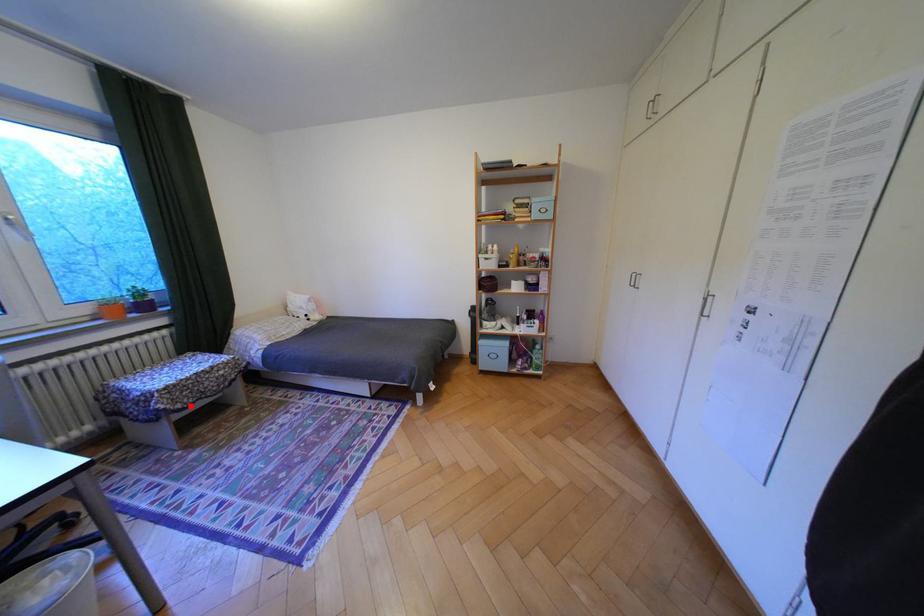
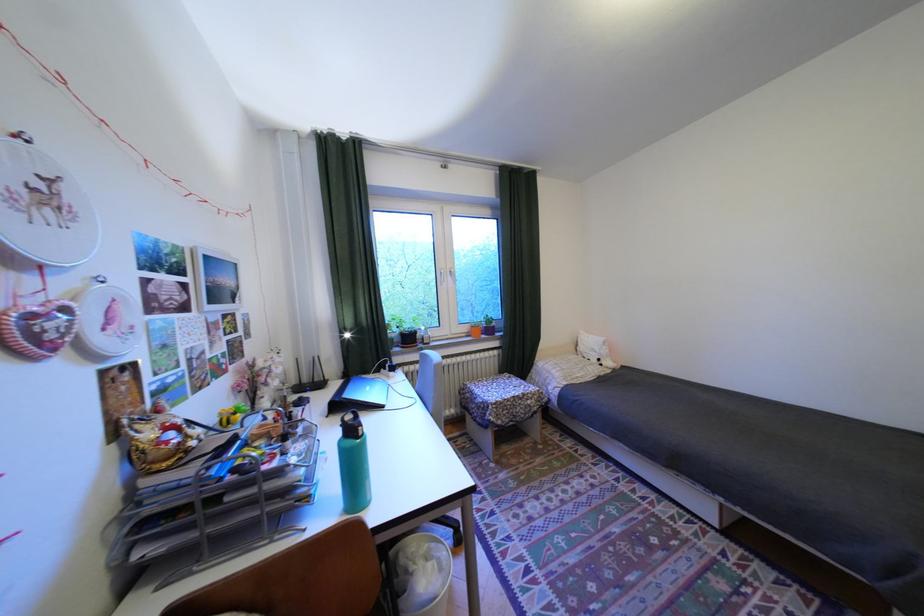
In the second image, find the point that corresponds to the highlighted location in the first image.

(512, 422)